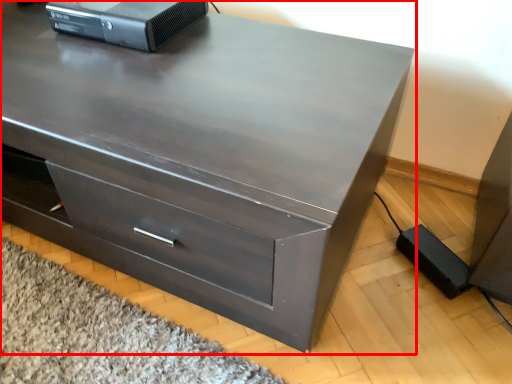
Question: Considering the relative positions of chest of drawers (annotated by the red box) and desktop computer in the image provided, where is chest of drawers (annotated by the red box) located with respect to the staircase?

Choices:
 (A) left
 (B) right

Answer: (A)